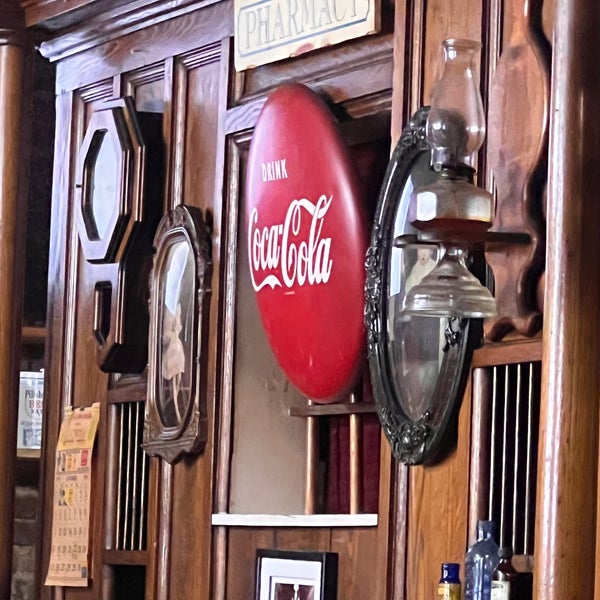
The image size is (600, 600). Find the location of `framed picture`. framed picture is located at coordinates (103, 186), (178, 323), (414, 341), (291, 587).